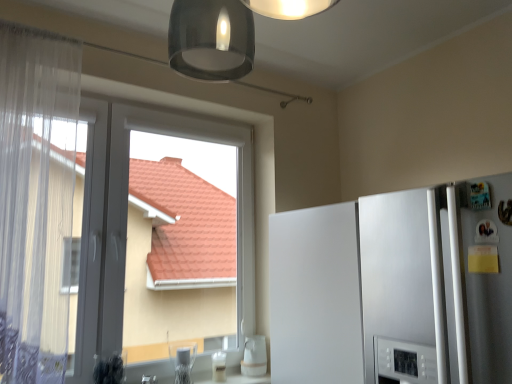
Question: Would you say clear glass at lower center, acting as the 1th appliance starting from the right, is to the left or to the right of white glossy cup at lower center, arranged as the first appliance when viewed from the left, in the picture?

Choices:
 (A) left
 (B) right

Answer: (B)

Question: Is clear glass at lower center, acting as the 1th appliance starting from the right, inside the boundaries of white glossy cup at lower center, the 2th appliance when ordered from right to left, or outside?

Choices:
 (A) inside
 (B) outside

Answer: (B)

Question: Estimate the real-world distances between objects in this image. Which object is closer to the white sheer curtain at left?

Choices:
 (A) transparent plastic window at left
 (B) white glossy refrigerator at right
 (C) clear glass at lower center, acting as the 1th appliance starting from the right
 (D) white glossy cup at lower center, the 2th appliance when ordered from right to left

Answer: (A)

Question: Estimate the real-world distances between objects in this image. Which object is farther from the white glossy cup at lower center, arranged as the first appliance when viewed from the left?

Choices:
 (A) transparent plastic window at left
 (B) white sheer curtain at left
 (C) clear glass at lower center, which is counted as the 2th appliance, starting from the left
 (D) white glossy refrigerator at right

Answer: (B)